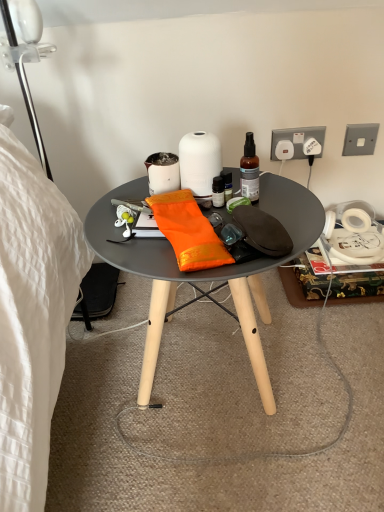
Question: Does white plastic power outlet at upper right, positioned as the second power outlet in left-to-right order, come in front of white plastic power outlet at upper right, which appears as the 1th power outlet when viewed from the left?

Choices:
 (A) yes
 (B) no

Answer: (A)

Question: Is white plastic power outlet at upper right, which ranks as the 3th power outlet in right-to-left order, behind white plastic power outlet at upper right, which appears as the 1th power outlet when viewed from the left?

Choices:
 (A) no
 (B) yes

Answer: (A)

Question: Does white plastic power outlet at upper right, which ranks as the 3th power outlet in right-to-left order, have a larger size compared to white plastic power outlet at upper right, which ranks as the 4th power outlet in right-to-left order?

Choices:
 (A) no
 (B) yes

Answer: (B)

Question: Is white plastic power outlet at upper right, which ranks as the 3th power outlet in right-to-left order, shorter than white plastic power outlet at upper right, which appears as the 1th power outlet when viewed from the left?

Choices:
 (A) yes
 (B) no

Answer: (B)

Question: Are white plastic power outlet at upper right, which ranks as the 3th power outlet in right-to-left order, and white plastic power outlet at upper right, which ranks as the 4th power outlet in right-to-left order, located far from each other?

Choices:
 (A) no
 (B) yes

Answer: (A)

Question: From a real-world perspective, is white plastic power outlet at upper right, which ranks as the 3th power outlet in right-to-left order, positioned under white plastic power outlet at upper right, which ranks as the 4th power outlet in right-to-left order, based on gravity?

Choices:
 (A) no
 (B) yes

Answer: (A)

Question: Is the surface of matte white coffee cup at center in direct contact with metallic silver power outlet at upper right, acting as the first power outlet starting from the right?

Choices:
 (A) yes
 (B) no

Answer: (B)

Question: Is matte white coffee cup at center oriented away from metallic silver power outlet at upper right, marked as the 4th power outlet in a left-to-right arrangement?

Choices:
 (A) no
 (B) yes

Answer: (A)

Question: From the image's perspective, is matte white coffee cup at center below metallic silver power outlet at upper right, acting as the first power outlet starting from the right?

Choices:
 (A) yes
 (B) no

Answer: (A)

Question: Does matte white coffee cup at center have a smaller size compared to metallic silver power outlet at upper right, acting as the first power outlet starting from the right?

Choices:
 (A) no
 (B) yes

Answer: (A)

Question: Can you confirm if matte white coffee cup at center is thinner than metallic silver power outlet at upper right, acting as the first power outlet starting from the right?

Choices:
 (A) yes
 (B) no

Answer: (B)

Question: Considering the relative sizes of matte white coffee cup at center and metallic silver power outlet at upper right, acting as the first power outlet starting from the right, in the image provided, is matte white coffee cup at center taller than metallic silver power outlet at upper right, acting as the first power outlet starting from the right,?

Choices:
 (A) yes
 (B) no

Answer: (B)

Question: Can you confirm if orange silk cloth at center is taller than white matte vase at center?

Choices:
 (A) no
 (B) yes

Answer: (A)